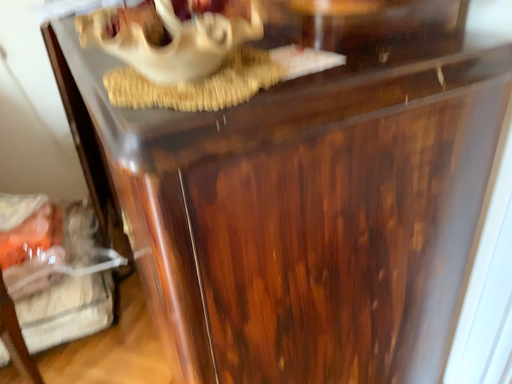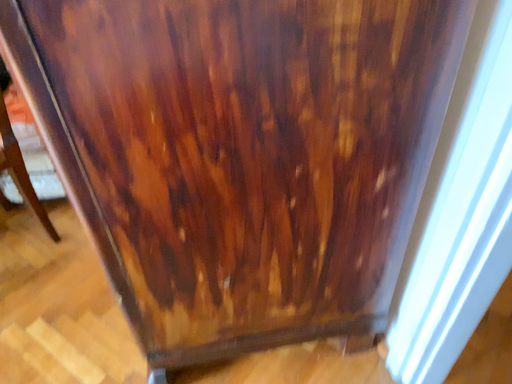
Question: Which way did the camera rotate in the video?

Choices:
 (A) rotated right
 (B) rotated left

Answer: (B)